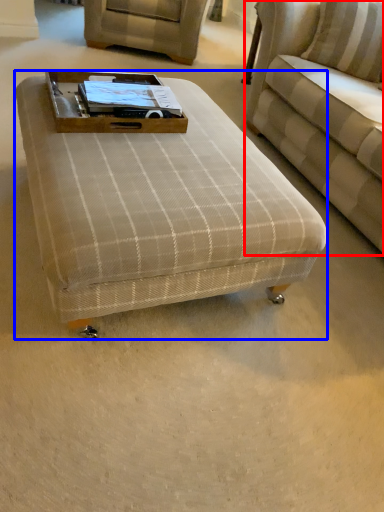
Question: Which object is further to the camera taking this photo, studio couch (highlighted by a red box) or table (highlighted by a blue box)?

Choices:
 (A) studio couch
 (B) table

Answer: (A)